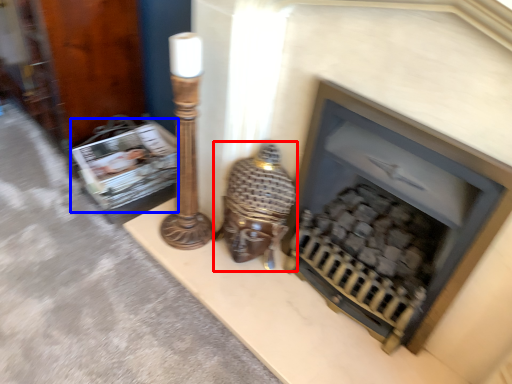
Question: Which of the following is the farthest to the observer, table lamp (highlighted by a red box) or magazine (highlighted by a blue box)?

Choices:
 (A) table lamp
 (B) magazine

Answer: (B)